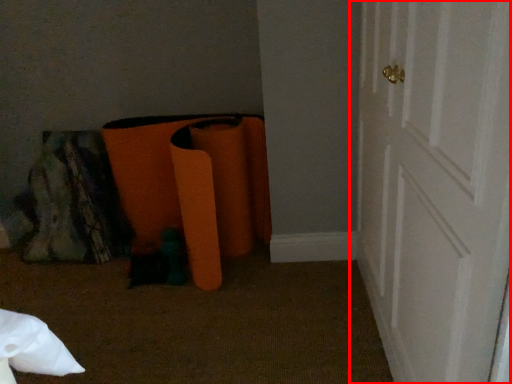
Question: Considering the relative positions of door (annotated by the red box) and bean bag chair in the image provided, where is door (annotated by the red box) located with respect to the staircase?

Choices:
 (A) right
 (B) left

Answer: (A)